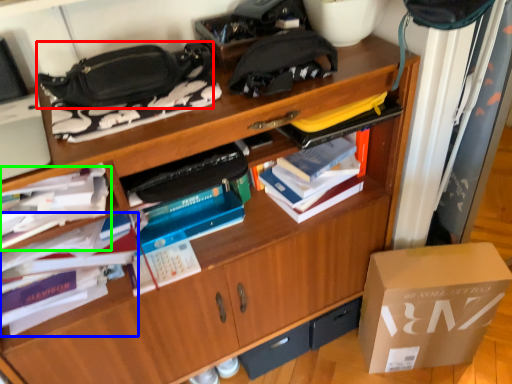
Question: Considering the real-world distances, which object is farthest from handbag (highlighted by a red box)? book (highlighted by a blue box) or book (highlighted by a green box)?

Choices:
 (A) book
 (B) book

Answer: (A)